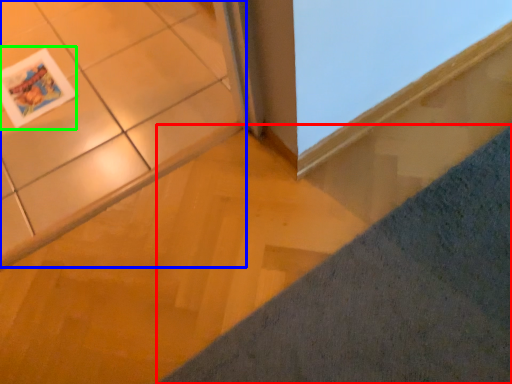
Question: Which object is the farthest from concrete (highlighted by a red box)? Choose among these: ceramic tile (highlighted by a blue box) or magazine (highlighted by a green box).

Choices:
 (A) ceramic tile
 (B) magazine

Answer: (B)